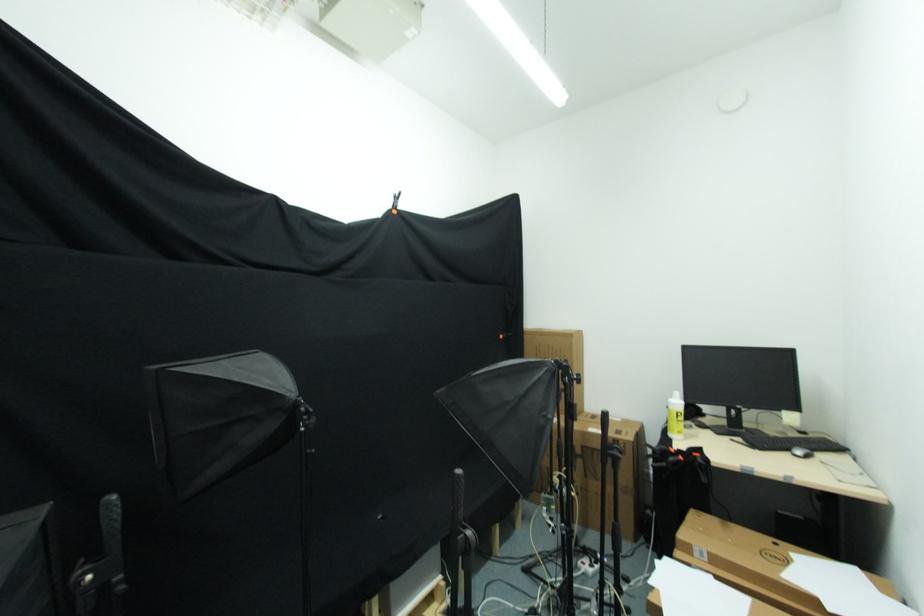
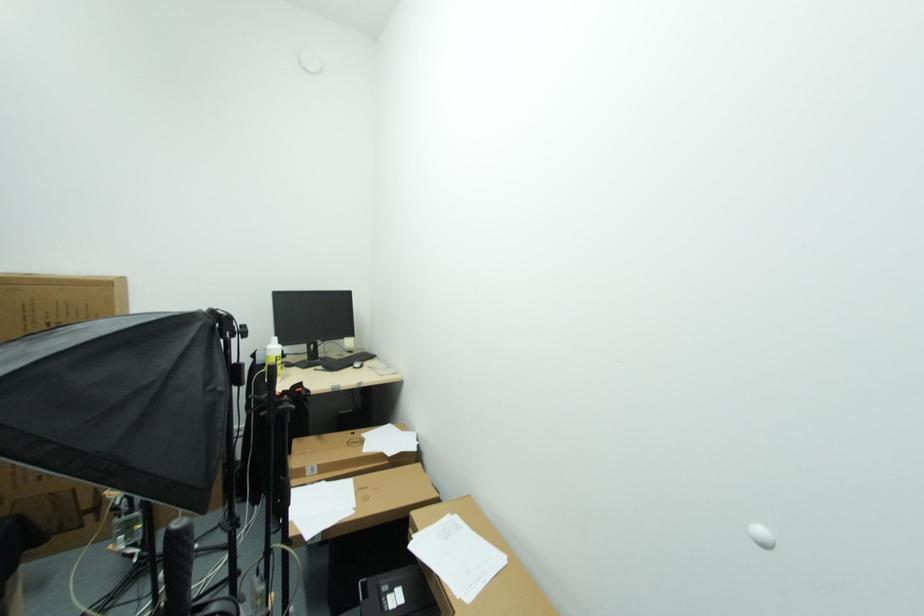
Find the pixel in the second image that matches pixel 747 434 in the first image.

(322, 363)